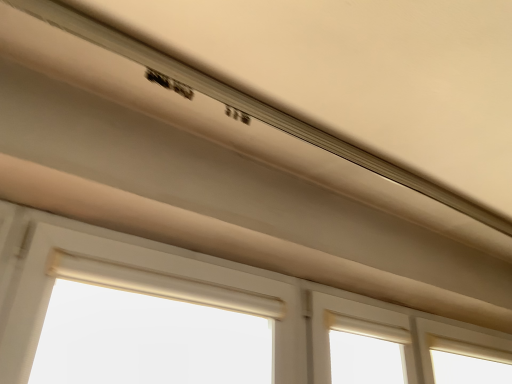
This screenshot has height=384, width=512. Describe the element at coordinates (151, 327) in the screenshot. I see `beige fabric curtain at lower center` at that location.

You are a GUI agent. You are given a task and a screenshot of the screen. Output one action in this format:
    pyautogui.click(x=<x>, y=<y>)
    Task: Click on the white matte window at center
    This screenshot has width=512, height=384.
    Given the screenshot: What is the action you would take?
    pyautogui.click(x=179, y=296)

Considering the sizes of objects matte white exhaust hood at upper center and white matte window at center in the image provided, who is shorter, matte white exhaust hood at upper center or white matte window at center?

Standing shorter between the two is white matte window at center.

Is matte white exhaust hood at upper center not within white matte window at center?

matte white exhaust hood at upper center lies outside white matte window at center's area.

Is matte white exhaust hood at upper center placed right next to white matte window at center?

No, matte white exhaust hood at upper center is not next to white matte window at center.

Is point (175, 60) less distant than point (122, 261)?

Yes, point (175, 60) is closer to viewer.

From a real-world perspective, who is located lower, matte white exhaust hood at upper center or beige fabric curtain at lower center?

beige fabric curtain at lower center.

Who is bigger, matte white exhaust hood at upper center or beige fabric curtain at lower center?

matte white exhaust hood at upper center.

Where is `exhaust hood in front of the beige fabric curtain at lower center`? The image size is (512, 384). exhaust hood in front of the beige fabric curtain at lower center is located at coordinates (245, 103).

Which is behind, beige fabric curtain at lower center or matte white exhaust hood at upper center?

beige fabric curtain at lower center is more distant.

From a real-world perspective, is beige fabric curtain at lower center located higher than matte white exhaust hood at upper center?

No, from a real-world perspective, beige fabric curtain at lower center is not over matte white exhaust hood at upper center

Between beige fabric curtain at lower center and matte white exhaust hood at upper center, which one has more height?

Standing taller between the two is matte white exhaust hood at upper center.

Considering the sizes of objects beige fabric curtain at lower center and matte white exhaust hood at upper center in the image provided, who is smaller, beige fabric curtain at lower center or matte white exhaust hood at upper center?

beige fabric curtain at lower center is smaller.

Consider the image. Between white matte window at center and matte white exhaust hood at upper center, which one is positioned behind?

white matte window at center.

Is white matte window at center spatially inside matte white exhaust hood at upper center, or outside of it?

white matte window at center cannot be found inside matte white exhaust hood at upper center.

From the image's perspective, which is above, white matte window at center or matte white exhaust hood at upper center?

matte white exhaust hood at upper center.

How far apart are white matte window at center and matte white exhaust hood at upper center?

The distance of white matte window at center from matte white exhaust hood at upper center is 53.37 centimeters.

Does point (332, 298) appear closer or farther from the camera than point (80, 327)?

Clearly, point (332, 298) is more distant from the camera than point (80, 327).

Identify the location of bay window below the white matte window at center (from a real-world perspective). (151, 327).

Considering the relative positions of white matte window at center and beige fabric curtain at lower center in the image provided, is white matte window at center to the left or to the right of beige fabric curtain at lower center?

Clearly, white matte window at center is on the right of beige fabric curtain at lower center in the image.

Between white matte window at center and beige fabric curtain at lower center, which one has larger width?

beige fabric curtain at lower center is wider.

From the image's perspective, is beige fabric curtain at lower center positioned above or below white matte window at center?

Based on their image positions, beige fabric curtain at lower center is located above white matte window at center.

Does beige fabric curtain at lower center have a greater width compared to white matte window at center?

Yes, beige fabric curtain at lower center is wider than white matte window at center.

Considering the relative sizes of beige fabric curtain at lower center and white matte window at center in the image provided, is beige fabric curtain at lower center shorter than white matte window at center?

Incorrect, the height of beige fabric curtain at lower center does not fall short of that of white matte window at center.

You are a GUI agent. You are given a task and a screenshot of the screen. Output one action in this format:
    pyautogui.click(x=<x>, y=<y>)
    Task: Click on the bay window below the white matte window at center (from a real-world perspective)
    
    Given the screenshot: What is the action you would take?
    pyautogui.click(x=151, y=327)

What are the coordinates of `window below the matte white exhaust hood at upper center (from a real-world perspective)` in the screenshot? It's located at (179, 296).

This screenshot has height=384, width=512. What are the coordinates of `exhaust hood located on the right of beige fabric curtain at lower center` in the screenshot? It's located at (245, 103).

From the image, which object appears to be farther from white matte window at center, matte white exhaust hood at upper center or beige fabric curtain at lower center?

matte white exhaust hood at upper center is further to white matte window at center.

Looking at the image, which one is located closer to white matte window at center, beige fabric curtain at lower center or matte white exhaust hood at upper center?

beige fabric curtain at lower center is closer to white matte window at center.

From the image, which object appears to be farther from beige fabric curtain at lower center, white matte window at center or matte white exhaust hood at upper center?

The object further to beige fabric curtain at lower center is matte white exhaust hood at upper center.

Looking at the image, which one is located closer to matte white exhaust hood at upper center, beige fabric curtain at lower center or white matte window at center?

white matte window at center lies closer to matte white exhaust hood at upper center than the other object.

When comparing their distances from beige fabric curtain at lower center, does matte white exhaust hood at upper center or white matte window at center seem further?

matte white exhaust hood at upper center.

Which object lies nearer to the anchor point matte white exhaust hood at upper center, white matte window at center or beige fabric curtain at lower center?

Based on the image, white matte window at center appears to be nearer to matte white exhaust hood at upper center.

Identify the location of window between beige fabric curtain at lower center and matte white exhaust hood at upper center. (179, 296).